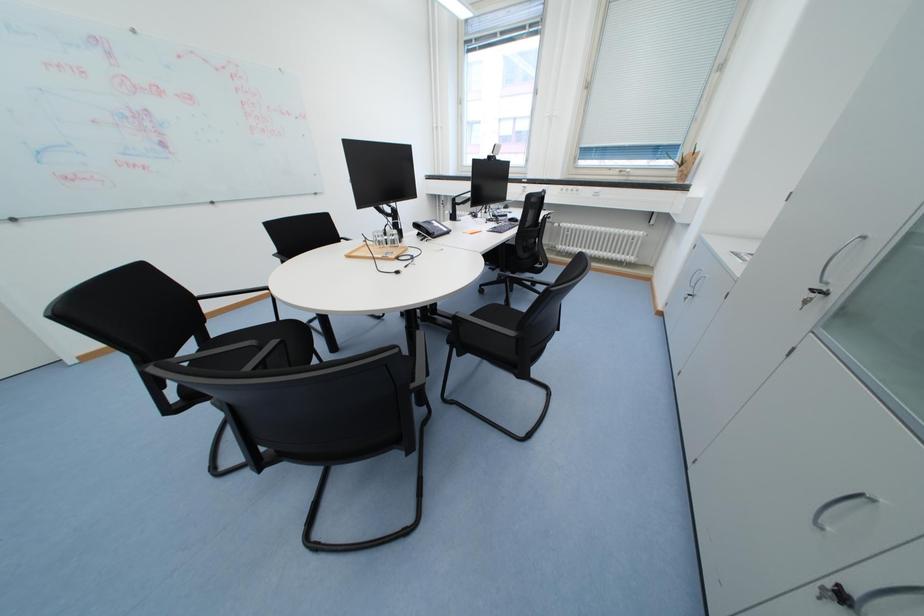
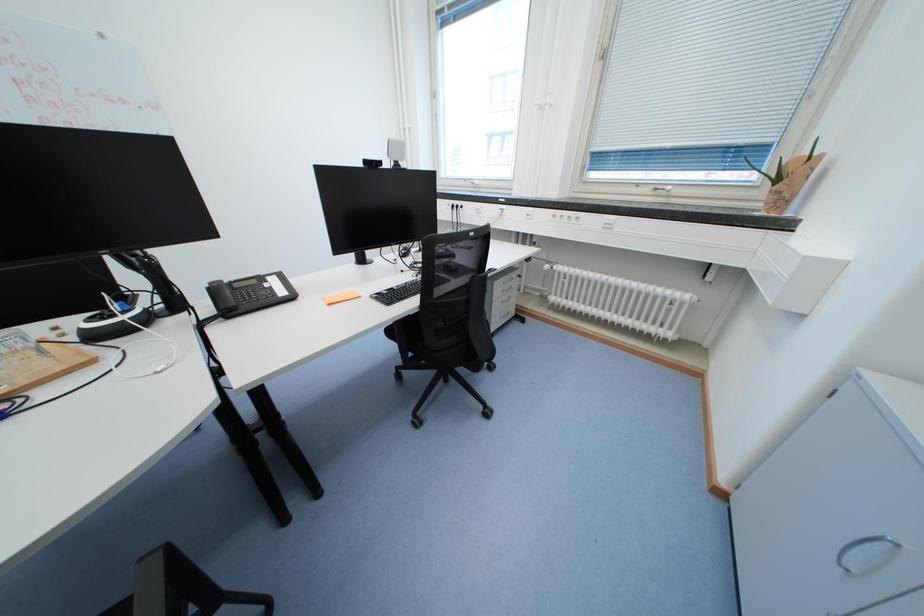
Based on the photo, which direction would the cameraman need to move to produce the second image?

The movement direction of the cameraman is right, forward.